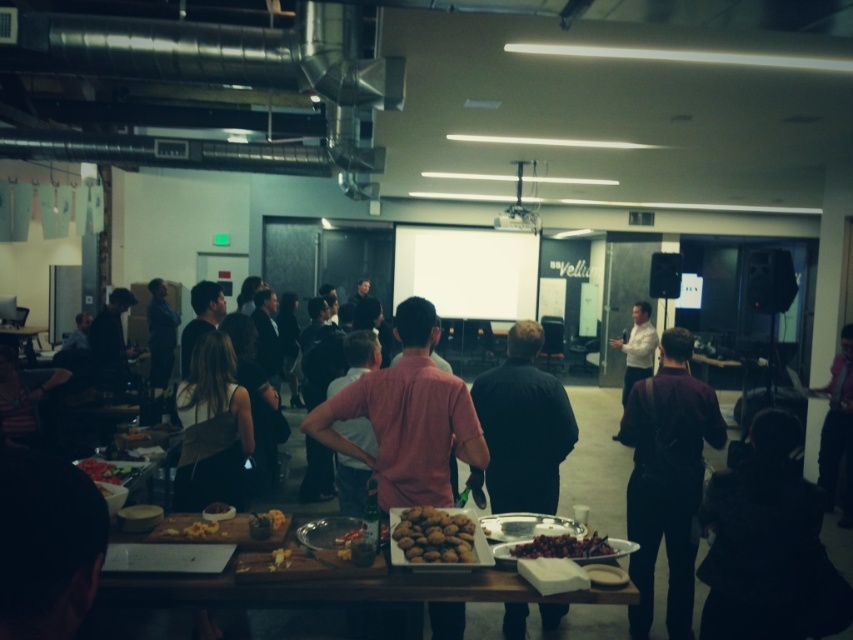
Question: Is wooden table at center to the right of white shirt at center from the viewer's perspective?

Choices:
 (A) yes
 (B) no

Answer: (B)

Question: Is dark fabric jacket at center positioned at the back of golden crumbly pastry at center?

Choices:
 (A) no
 (B) yes

Answer: (B)

Question: Can you confirm if white matte projection screen at center is positioned above black satin dress at lower left?

Choices:
 (A) no
 (B) yes

Answer: (B)

Question: Which point is closer to the camera?

Choices:
 (A) dark fabric jacket at center
 (B) brown matte cookies at center

Answer: (B)

Question: Which point is farther to the camera?

Choices:
 (A) (421, 508)
 (B) (582, 554)
 (C) (169, 323)
 (D) (231, 512)

Answer: (C)

Question: Which point is farther to the camera?

Choices:
 (A) (28, 333)
 (B) (540, 554)

Answer: (A)